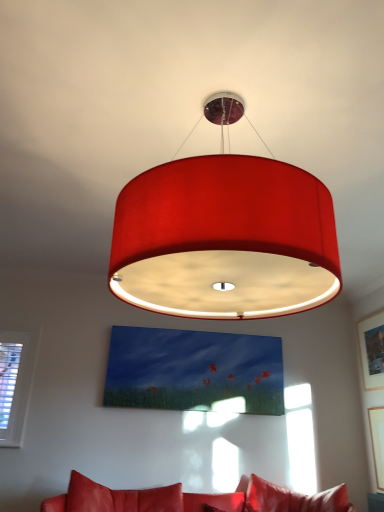
Identify the location of matte fabric lampshade at center. This screenshot has width=384, height=512. (225, 239).

How much space does matte white picture frame at upper right, which is the 1th picture frame in bottom-to-top order, occupy vertically?

matte white picture frame at upper right, which is the 1th picture frame in bottom-to-top order, is 70.87 centimeters in height.

Measure the distance between leather couch at lower center and camera.

The depth of leather couch at lower center is 3.09 meters.

This screenshot has height=512, width=384. Describe the element at coordinates (194, 499) in the screenshot. I see `leather couch at lower center` at that location.

Locate an element on the screen. matte fabric lampshade at center is located at coordinates (225, 239).

Is wooden picture frame at upper right, which is the second picture frame from bottom to top, at the back of leather couch at lower center?

leather couch at lower center does not have its back to wooden picture frame at upper right, which is the second picture frame from bottom to top.

From a real-world perspective, is leather couch at lower center physically located above or below wooden picture frame at upper right, the first picture frame positioned from the top?

Clearly, from a real-world perspective, leather couch at lower center is below wooden picture frame at upper right, the first picture frame positioned from the top.

From the image's perspective, is leather couch at lower center on wooden picture frame at upper right, which is the second picture frame from bottom to top?

Actually, leather couch at lower center appears below wooden picture frame at upper right, which is the second picture frame from bottom to top, in the image.

Is there a large distance between leather couch at lower center and wooden picture frame at upper right, the first picture frame positioned from the top?

That's right, there is a large distance between leather couch at lower center and wooden picture frame at upper right, the first picture frame positioned from the top.

Is matte fabric lampshade at center shorter than leather couch at lower center?

In fact, matte fabric lampshade at center may be taller than leather couch at lower center.

Consider the image. From the image's perspective, is matte fabric lampshade at center positioned above or below leather couch at lower center?

Clearly, from the image's perspective, matte fabric lampshade at center is above leather couch at lower center.

Is point (177, 161) closer to viewer compared to point (260, 511)?

That is True.

You are a GUI agent. You are given a task and a screenshot of the screen. Output one action in this format:
    pyautogui.click(x=<x>, y=<y>)
    Task: Click on the lamp above the leather couch at lower center (from the image's perspective)
    This screenshot has width=384, height=512.
    Given the screenshot: What is the action you would take?
    pyautogui.click(x=225, y=239)

Locate an element on the screen. Image resolution: width=384 pixels, height=512 pixels. picture frame that is on the right side of matte white picture frame at upper right, which is the 1th picture frame in bottom-to-top order is located at coordinates (372, 350).

Is wooden picture frame at upper right, the first picture frame positioned from the top, turned away from matte white picture frame at upper right, which is the 2th picture frame in top-to-bottom order?

wooden picture frame at upper right, the first picture frame positioned from the top, does not have its back to matte white picture frame at upper right, which is the 2th picture frame in top-to-bottom order.

Does wooden picture frame at upper right, the first picture frame positioned from the top, contain matte white picture frame at upper right, which is the 2th picture frame in top-to-bottom order?

Definitely not — matte white picture frame at upper right, which is the 2th picture frame in top-to-bottom order, is not inside wooden picture frame at upper right, the first picture frame positioned from the top.

Is point (370, 375) closer or farther from the camera than point (381, 426)?

Clearly, point (370, 375) is more distant from the camera than point (381, 426).

Could you tell me if matte fabric lampshade at center is facing matte white picture frame at upper right, which is the 2th picture frame in top-to-bottom order?

No, matte fabric lampshade at center is not aimed at matte white picture frame at upper right, which is the 2th picture frame in top-to-bottom order.

Considering their positions, is matte fabric lampshade at center located in front of or behind matte white picture frame at upper right, which is the 2th picture frame in top-to-bottom order?

Visually, matte fabric lampshade at center is located in front of matte white picture frame at upper right, which is the 2th picture frame in top-to-bottom order.

Is matte fabric lampshade at center next to matte white picture frame at upper right, which is the 2th picture frame in top-to-bottom order?

They are not placed beside each other.

How different are the orientations of matte fabric lampshade at center and matte white picture frame at upper right, which is the 2th picture frame in top-to-bottom order, in degrees?

They differ by 0.00831 degrees in their facing directions.

Does point (342, 510) lie behind point (378, 429)?

No, (342, 510) is in front of (378, 429).

Does leather couch at lower center have a larger size compared to matte white picture frame at upper right, which is the 2th picture frame in top-to-bottom order?

Indeed, leather couch at lower center has a larger size compared to matte white picture frame at upper right, which is the 2th picture frame in top-to-bottom order.

Which of these two, leather couch at lower center or matte white picture frame at upper right, which is the 2th picture frame in top-to-bottom order, stands taller?

With more height is matte white picture frame at upper right, which is the 2th picture frame in top-to-bottom order.

From the image's perspective, does leather couch at lower center appear higher than matte white picture frame at upper right, which is the 2th picture frame in top-to-bottom order?

No.

Is matte white picture frame at upper right, which is the 2th picture frame in top-to-bottom order, facing towards matte fabric lampshade at center?

No.

Is matte white picture frame at upper right, which is the 1th picture frame in bottom-to-top order, with matte fabric lampshade at center?

matte white picture frame at upper right, which is the 1th picture frame in bottom-to-top order, and matte fabric lampshade at center are not in contact.

Can you confirm if matte white picture frame at upper right, which is the 2th picture frame in top-to-bottom order, is shorter than matte fabric lampshade at center?

Yes, matte white picture frame at upper right, which is the 2th picture frame in top-to-bottom order, is shorter than matte fabric lampshade at center.

Is matte white picture frame at upper right, which is the 2th picture frame in top-to-bottom order, completely or partially outside of matte fabric lampshade at center?

Indeed, matte white picture frame at upper right, which is the 2th picture frame in top-to-bottom order, is completely outside matte fabric lampshade at center.

Between leather couch at lower center and matte fabric lampshade at center, which one has less height?

leather couch at lower center.

Is leather couch at lower center in front of or behind matte fabric lampshade at center in the image?

leather couch at lower center is behind matte fabric lampshade at center.

The image size is (384, 512). In order to click on lamp above the leather couch at lower center (from a real-world perspective) in this screenshot , I will do `click(225, 239)`.

From a real-world perspective, is leather couch at lower center on matte fabric lampshade at center?

No.

Where is `studio couch lying below the wooden picture frame at upper right, the first picture frame positioned from the top (from the image's perspective)`? studio couch lying below the wooden picture frame at upper right, the first picture frame positioned from the top (from the image's perspective) is located at coordinates (194, 499).

Where is `lamp that is above the leather couch at lower center (from the image's perspective)`? This screenshot has height=512, width=384. lamp that is above the leather couch at lower center (from the image's perspective) is located at coordinates (225, 239).

Considering their positions, is leather couch at lower center positioned further to wooden picture frame at upper right, which is the second picture frame from bottom to top, than matte white picture frame at upper right, which is the 2th picture frame in top-to-bottom order?

Based on the image, leather couch at lower center appears to be further to wooden picture frame at upper right, which is the second picture frame from bottom to top.

Which object lies further to the anchor point matte fabric lampshade at center, wooden picture frame at upper right, which is the second picture frame from bottom to top, or matte white picture frame at upper right, which is the 1th picture frame in bottom-to-top order?

The object further to matte fabric lampshade at center is matte white picture frame at upper right, which is the 1th picture frame in bottom-to-top order.

Estimate the real-world distances between objects in this image. Which object is further from matte white picture frame at upper right, which is the 1th picture frame in bottom-to-top order, matte fabric lampshade at center or wooden picture frame at upper right, which is the second picture frame from bottom to top?

Based on the image, matte fabric lampshade at center appears to be further to matte white picture frame at upper right, which is the 1th picture frame in bottom-to-top order.

Based on their spatial positions, is leather couch at lower center or wooden picture frame at upper right, the first picture frame positioned from the top, closer to matte fabric lampshade at center?

leather couch at lower center is closer to matte fabric lampshade at center.

When comparing their distances from wooden picture frame at upper right, which is the second picture frame from bottom to top, does matte white picture frame at upper right, which is the 1th picture frame in bottom-to-top order, or matte fabric lampshade at center seem further?

Based on the image, matte fabric lampshade at center appears to be further to wooden picture frame at upper right, which is the second picture frame from bottom to top.

Which object lies nearer to the anchor point wooden picture frame at upper right, the first picture frame positioned from the top, matte fabric lampshade at center or matte white picture frame at upper right, which is the 1th picture frame in bottom-to-top order?

matte white picture frame at upper right, which is the 1th picture frame in bottom-to-top order, is closer to wooden picture frame at upper right, the first picture frame positioned from the top.

When comparing their distances from leather couch at lower center, does matte white picture frame at upper right, which is the 1th picture frame in bottom-to-top order, or matte fabric lampshade at center seem closer?

Based on the image, matte white picture frame at upper right, which is the 1th picture frame in bottom-to-top order, appears to be nearer to leather couch at lower center.

Based on their spatial positions, is wooden picture frame at upper right, the first picture frame positioned from the top, or matte fabric lampshade at center closer to matte white picture frame at upper right, which is the 1th picture frame in bottom-to-top order?

wooden picture frame at upper right, the first picture frame positioned from the top, is positioned closer to the anchor matte white picture frame at upper right, which is the 1th picture frame in bottom-to-top order.

The image size is (384, 512). I want to click on picture frame situated between leather couch at lower center and wooden picture frame at upper right, the first picture frame positioned from the top, from left to right, so click(x=377, y=442).

What are the coordinates of `picture frame between matte fabric lampshade at center and wooden picture frame at upper right, which is the second picture frame from bottom to top, in the front-back direction` in the screenshot? It's located at (377, 442).

Locate an element on the screen. studio couch located between matte fabric lampshade at center and wooden picture frame at upper right, which is the second picture frame from bottom to top, in the depth direction is located at coordinates (194, 499).